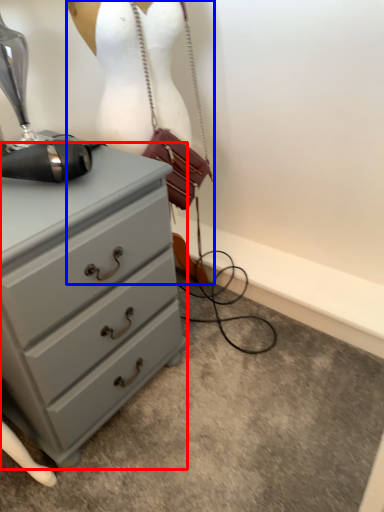
Question: Which object is further to the camera taking this photo, chest of drawers (highlighted by a red box) or mannequin (highlighted by a blue box)?

Choices:
 (A) chest of drawers
 (B) mannequin

Answer: (B)